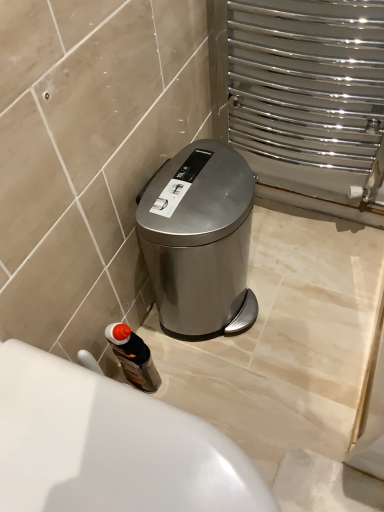
What do you see at coordinates (200, 240) in the screenshot?
I see `satin silver trash can at center` at bounding box center [200, 240].

Measure the distance between wooden textured bottle at lower left and camera.

wooden textured bottle at lower left is 85.18 centimeters away from camera.

This screenshot has width=384, height=512. I want to click on satin silver trash can at center, so pyautogui.click(x=200, y=240).

From a real-world perspective, which is physically below, wooden textured bottle at lower left or satin silver trash can at center?

wooden textured bottle at lower left is physically lower.

From the picture: Can you tell me how much wooden textured bottle at lower left and satin silver trash can at center differ in facing direction?

wooden textured bottle at lower left and satin silver trash can at center are facing 7.74 degrees away from each other.

Consider the image. From the image's perspective, which is below, wooden textured bottle at lower left or satin silver trash can at center?

wooden textured bottle at lower left.

Is wooden textured bottle at lower left outside of satin silver trash can at center?

Yes, wooden textured bottle at lower left is not within satin silver trash can at center.

Based on the photo, from a real-world perspective, is wooden textured bottle at lower left below white glossy bath at lower left?

Yes, from a real-world perspective, wooden textured bottle at lower left is under white glossy bath at lower left.

Is wooden textured bottle at lower left outside of white glossy bath at lower left?

Yes, wooden textured bottle at lower left is located beyond the bounds of white glossy bath at lower left.

From the image's perspective, who appears lower, wooden textured bottle at lower left or white glossy bath at lower left?

white glossy bath at lower left.

Considering their positions, is wooden textured bottle at lower left located in front of or behind white glossy bath at lower left?

Clearly, wooden textured bottle at lower left is behind white glossy bath at lower left.

From the picture: Is white glossy bath at lower left oriented away from wooden textured bottle at lower left?

No, wooden textured bottle at lower left is not at the back of white glossy bath at lower left.

From a real-world perspective, is white glossy bath at lower left on top of wooden textured bottle at lower left?

Yes, from a real-world perspective, white glossy bath at lower left is on top of wooden textured bottle at lower left.

Is white glossy bath at lower left beside wooden textured bottle at lower left?

No, white glossy bath at lower left is not next to wooden textured bottle at lower left.

From the image's perspective, which is below, white glossy bath at lower left or satin silver trash can at center?

white glossy bath at lower left, from the image's perspective.

Between white glossy bath at lower left and satin silver trash can at center, which one has smaller size?

satin silver trash can at center.

Considering the sizes of objects white glossy bath at lower left and satin silver trash can at center in the image provided, who is taller, white glossy bath at lower left or satin silver trash can at center?

satin silver trash can at center is taller.

Choose the correct answer: Is satin silver trash can at center inside white glossy bath at lower left or outside it?

satin silver trash can at center is outside white glossy bath at lower left.

This screenshot has width=384, height=512. I want to click on waste container below the white glossy bath at lower left (from a real-world perspective), so click(x=200, y=240).

Who is shorter, satin silver trash can at center or white glossy bath at lower left?

With less height is white glossy bath at lower left.

Considering the relative sizes of satin silver trash can at center and wooden textured bottle at lower left in the image provided, is satin silver trash can at center thinner than wooden textured bottle at lower left?

Incorrect, the width of satin silver trash can at center is not less than that of wooden textured bottle at lower left.

In the scene shown: How different are the orientations of satin silver trash can at center and wooden textured bottle at lower left in degrees?

They differ by 7.74 degrees in their facing directions.

This screenshot has width=384, height=512. I want to click on bottle that appears on the left of satin silver trash can at center, so click(x=133, y=357).

Does point (195, 200) appear closer or farther from the camera than point (110, 334)?

Point (195, 200) is closer to the camera than point (110, 334).

In the image, there is a satin silver trash can at center. Where is `bottle below it (from a real-world perspective)`? The width and height of the screenshot is (384, 512). bottle below it (from a real-world perspective) is located at coordinates (133, 357).

This screenshot has width=384, height=512. I want to click on bottle to the left of white glossy bath at lower left, so click(x=133, y=357).

From the image, which object appears to be nearer to wooden textured bottle at lower left, white glossy bath at lower left or satin silver trash can at center?

Among the two, satin silver trash can at center is located nearer to wooden textured bottle at lower left.

When comparing their distances from white glossy bath at lower left, does wooden textured bottle at lower left or satin silver trash can at center seem closer?

wooden textured bottle at lower left is closer to white glossy bath at lower left.

Based on the photo, considering their positions, is satin silver trash can at center positioned closer to white glossy bath at lower left than wooden textured bottle at lower left?

wooden textured bottle at lower left lies closer to white glossy bath at lower left than the other object.

Which object lies nearer to the anchor point satin silver trash can at center, wooden textured bottle at lower left or white glossy bath at lower left?

The object closer to satin silver trash can at center is wooden textured bottle at lower left.

Which object lies further to the anchor point wooden textured bottle at lower left, satin silver trash can at center or white glossy bath at lower left?

Among the two, white glossy bath at lower left is located further to wooden textured bottle at lower left.

Estimate the real-world distances between objects in this image. Which object is closer to satin silver trash can at center, white glossy bath at lower left or wooden textured bottle at lower left?

Based on the image, wooden textured bottle at lower left appears to be nearer to satin silver trash can at center.

Find the location of a particular element. This screenshot has width=384, height=512. waste container between white glossy bath at lower left and wooden textured bottle at lower left from front to back is located at coordinates (200, 240).